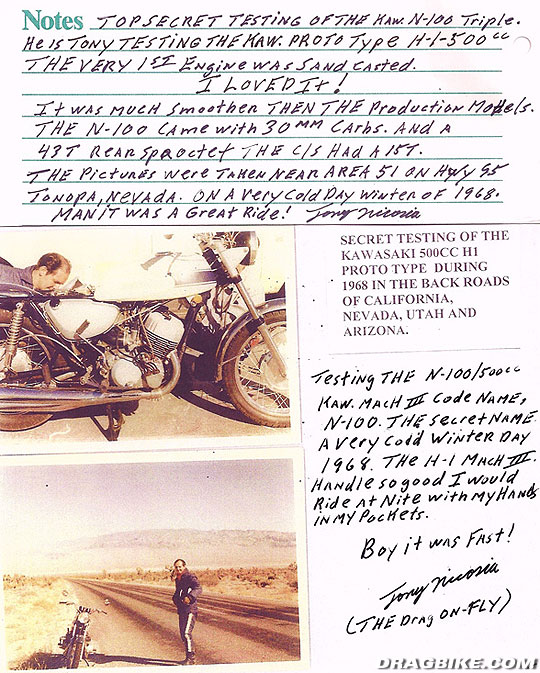
This screenshot has height=673, width=540. I want to click on notes, so click(x=63, y=24).